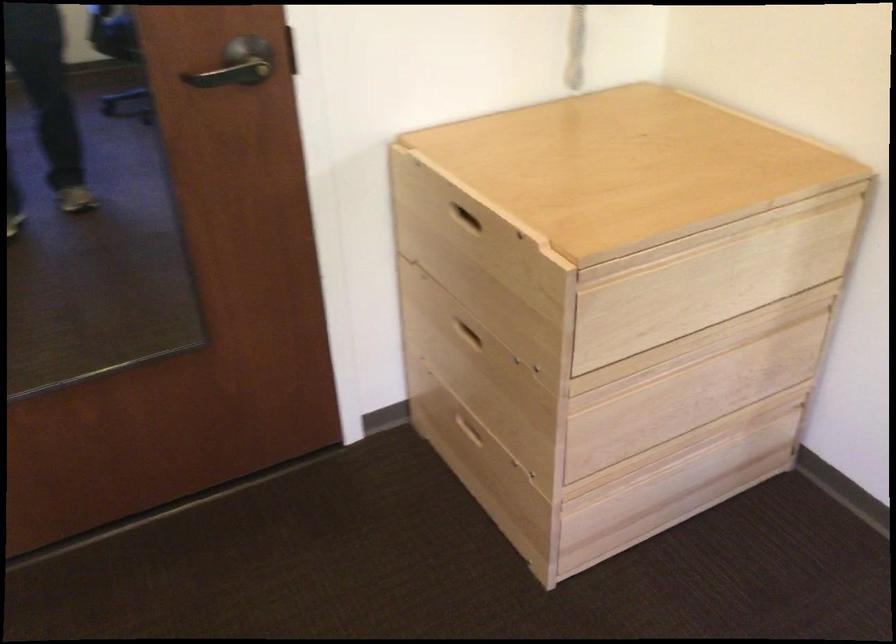
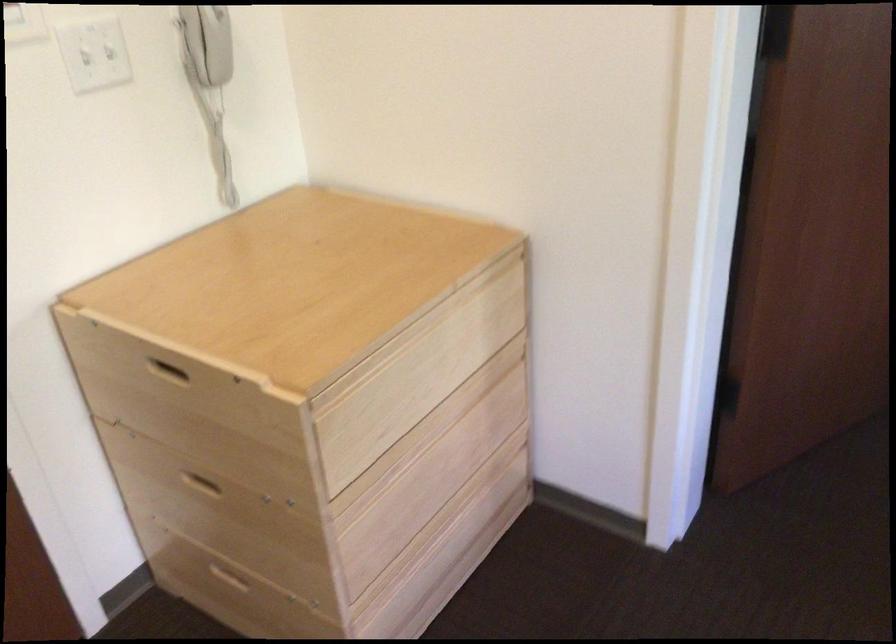
Question: Which direction would the cameraman need to move to produce the second image? Reply with the corresponding letter.

Choices:
 (A) Left
 (B) Right
 (C) Forward
 (D) Backward

Answer: (A)